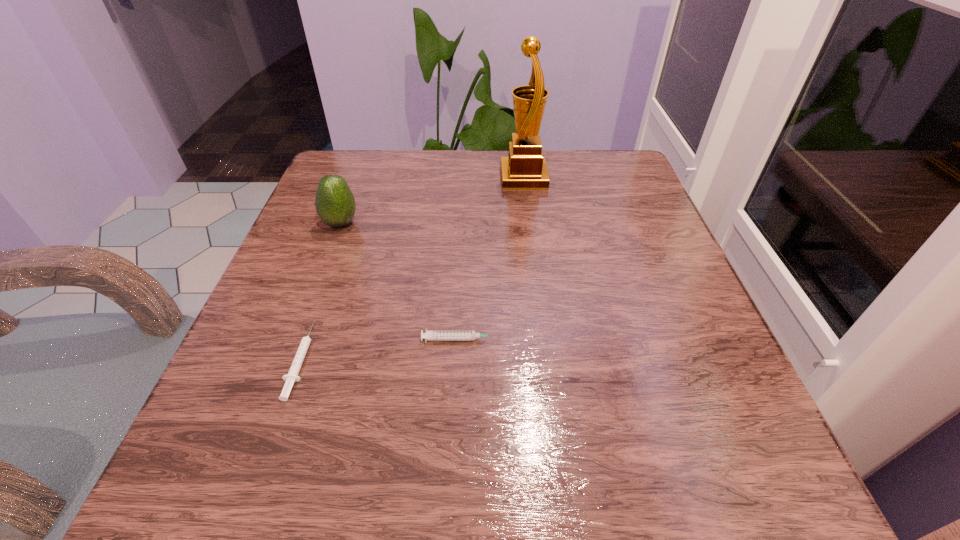
Locate an element on the screen. The height and width of the screenshot is (540, 960). free space between the third tallest object and the tallest object is located at coordinates (492, 258).

The image size is (960, 540). What are the coordinates of `vacant space that's between the left syringe and the rightmost object` in the screenshot? It's located at (412, 268).

Locate an element on the screen. The image size is (960, 540). object that ranks as the second closest to the shortest object is located at coordinates (335, 204).

You are a GUI agent. You are given a task and a screenshot of the screen. Output one action in this format:
    pyautogui.click(x=<x>, y=<y>)
    Task: Click on the closest object to the taller syringe
    The width and height of the screenshot is (960, 540).
    Given the screenshot: What is the action you would take?
    pyautogui.click(x=292, y=376)

Identify the location of vacant point that satisfies the following two spatial constraints: 1. on the front-facing side of the tallest object; 2. on the front side of the shorter syringe. The image size is (960, 540). (548, 360).